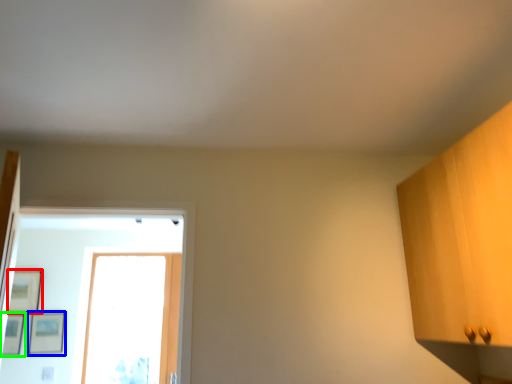
Question: Based on their relative distances, which object is farther from picture frame (highlighted by a red box)? Choose from picture frame (highlighted by a blue box) and picture frame (highlighted by a green box).

Choices:
 (A) picture frame
 (B) picture frame

Answer: (A)